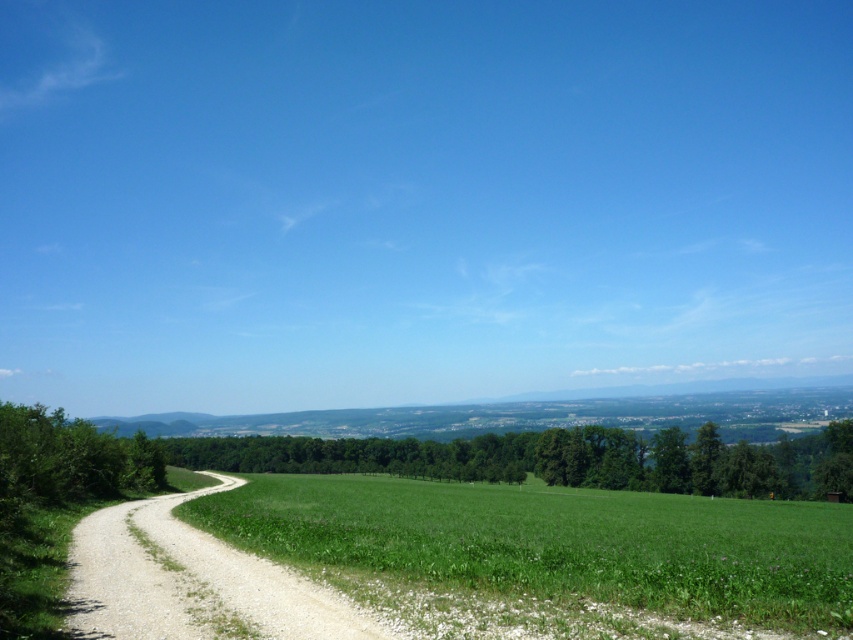
Does green leafy trees at center lie behind green leafy tree at left?

Yes, it is.

Who is positioned more to the left, green leafy trees at center or green leafy tree at left?

green leafy tree at left

Which is behind, point (668, 435) or point (10, 424)?

The point (668, 435) is behind.

This screenshot has width=853, height=640. In order to click on green leafy trees at center in this screenshot , I will do `click(555, 460)`.

You are a GUI agent. You are given a task and a screenshot of the screen. Output one action in this format:
    pyautogui.click(x=<x>, y=<y>)
    Task: Click on the green grass at center
    
    Given the screenshot: What is the action you would take?
    pyautogui.click(x=558, y=541)

Where is `green grass at center`? The height and width of the screenshot is (640, 853). green grass at center is located at coordinates (x=558, y=541).

Which of these two, green grass at center or green leafy tree at left, stands shorter?

With less height is green leafy tree at left.

Image resolution: width=853 pixels, height=640 pixels. What are the coordinates of `green grass at center` in the screenshot? It's located at (558, 541).

This screenshot has width=853, height=640. I want to click on green grass at center, so pos(558,541).